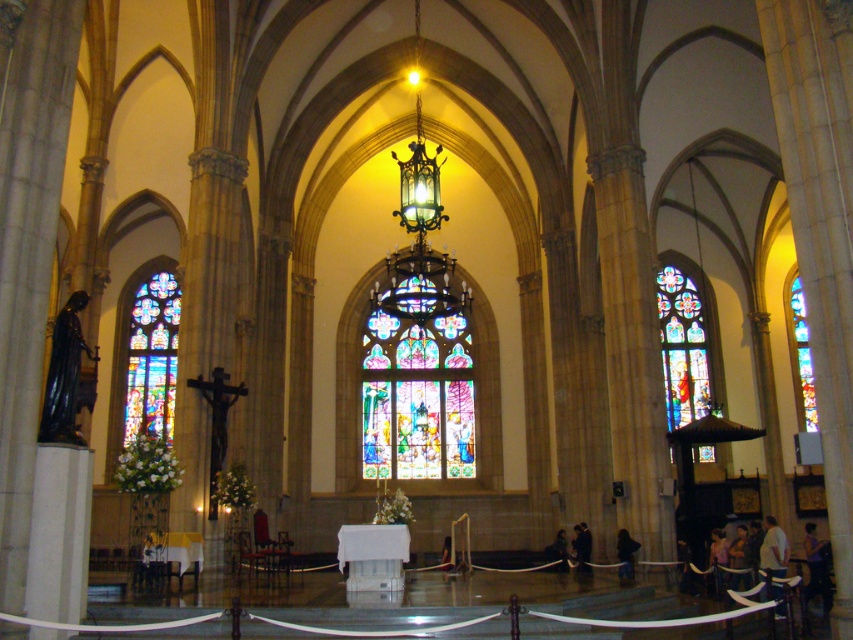
Measure the distance between stained glass window at right and camera.

The distance of stained glass window at right from camera is 108.19 meters.

In the scene shown: Who is more forward, (694, 451) or (579, 528)?

Point (579, 528) is more forward.

Image resolution: width=853 pixels, height=640 pixels. What are the coordinates of `stained glass window at right` in the screenshot? It's located at (682, 346).

This screenshot has height=640, width=853. I want to click on stained glass window at right, so click(682, 346).

What do you see at coordinates (416, 388) in the screenshot? I see `stained glass window at center` at bounding box center [416, 388].

Between point (445, 348) and point (795, 339), which one is positioned behind?

Positioned behind is point (795, 339).

From the picture: Who is more distant from viewer, (405, 280) or (798, 356)?

Point (405, 280)

The width and height of the screenshot is (853, 640). I want to click on stained glass window at center, so click(416, 388).

Does stained glass window at center appear on the right side of dark brown leather jacket at lower right?

Incorrect, stained glass window at center is not on the right side of dark brown leather jacket at lower right.

Between stained glass window at center and dark brown leather jacket at lower right, which one appears on the left side from the viewer's perspective?

stained glass window at center is more to the left.

Is point (389, 429) positioned behind point (630, 568)?

Yes, point (389, 429) is behind point (630, 568).

Locate an element on the screen. The width and height of the screenshot is (853, 640). stained glass window at center is located at coordinates (416, 388).